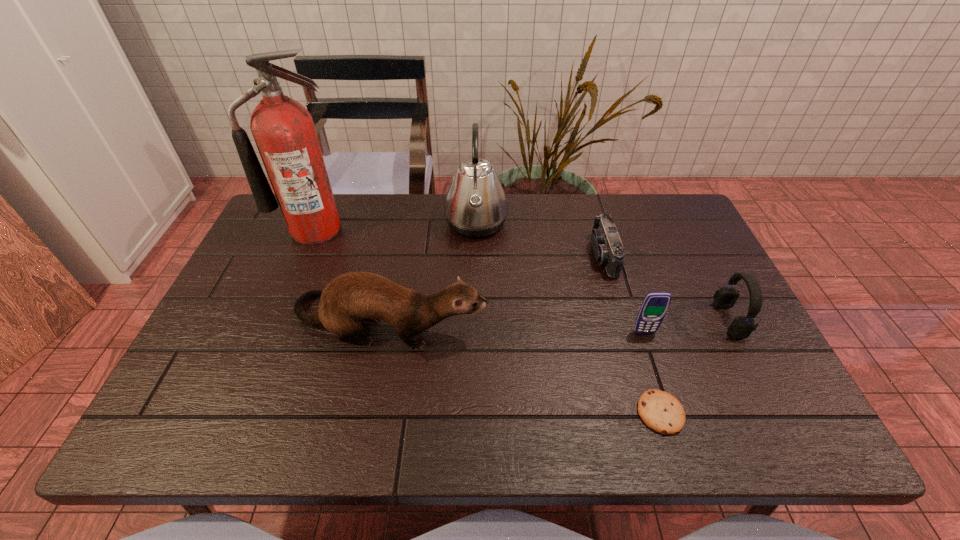
I want to click on free region located at the face of the third tallest object, so click(x=647, y=322).

What are the coordinates of `free point located 0.260m on the headband of the rightmost object` in the screenshot? It's located at (613, 320).

Where is `free region located on the headband of the rightmost object`? free region located on the headband of the rightmost object is located at coordinates (630, 320).

The height and width of the screenshot is (540, 960). In order to click on free space located 0.210m on the headband of the rightmost object in this screenshot , I will do click(634, 320).

The image size is (960, 540). Identify the location of free location located on the front-facing side of the cellular telephone. (675, 423).

The height and width of the screenshot is (540, 960). Find the location of `blank space located on the front-facing side of the camcorder`. blank space located on the front-facing side of the camcorder is located at coordinates point(509,255).

Find the location of a particular element. vacant space located 0.260m on the front-facing side of the camcorder is located at coordinates (502, 255).

I want to click on vacant area situated 0.270m on the front-facing side of the camcorder, so click(x=498, y=255).

Where is `vacant space located 0.300m on the left of the shortest object`? The height and width of the screenshot is (540, 960). vacant space located 0.300m on the left of the shortest object is located at coordinates (495, 413).

The width and height of the screenshot is (960, 540). Identify the location of fire extinguisher present at the far edge. (283, 129).